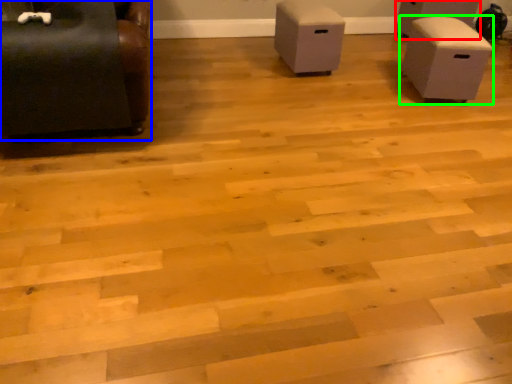
Question: Which is nearer to the furniture (highlighted by a red box)? furniture (highlighted by a blue box) or furniture (highlighted by a green box).

Choices:
 (A) furniture
 (B) furniture

Answer: (B)